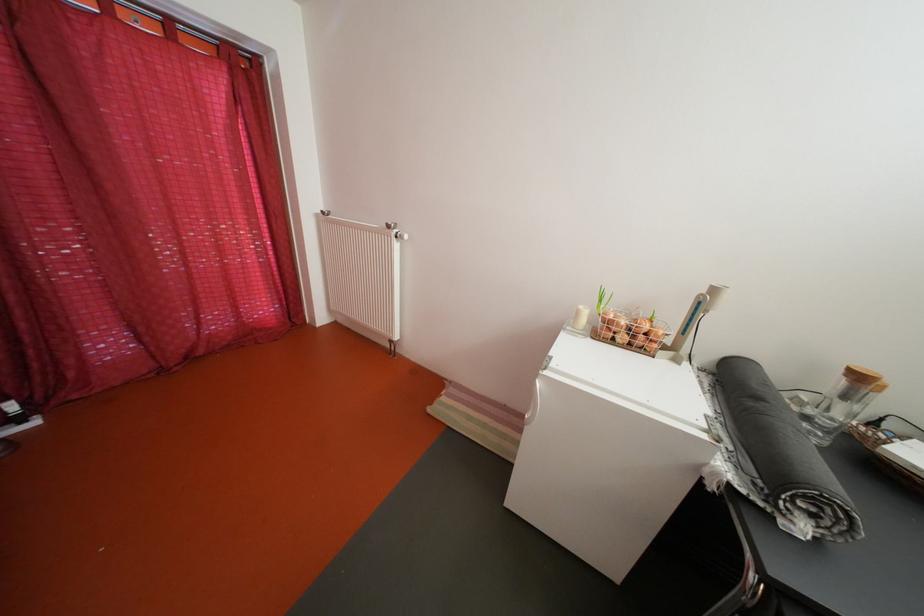
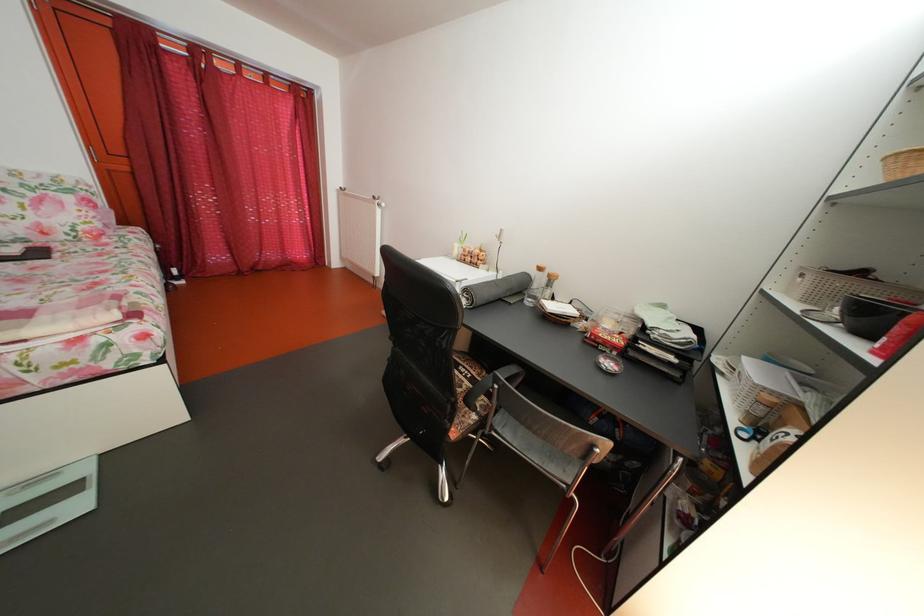
In a continuous first-person perspective shot, in which direction is the camera moving?

The cameraman walked toward right, backward.